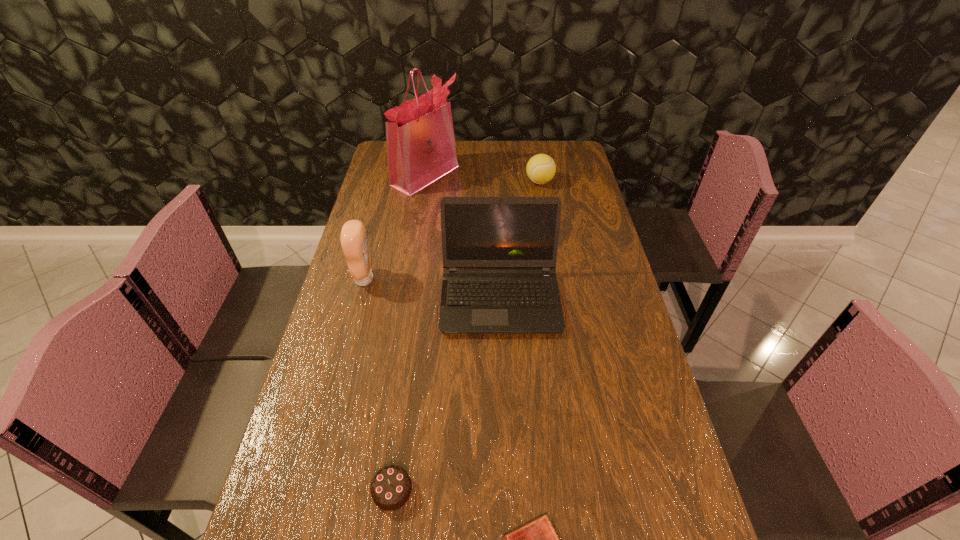
I want to click on vacant point located between the chocolate cake and the laptop_computer, so click(x=446, y=394).

Locate an element on the screen. This screenshot has width=960, height=540. free space that is in between the laptop_computer and the chocolate cake is located at coordinates point(446,394).

Where is `free space between the second nearest object and the tennis ball`? The width and height of the screenshot is (960, 540). free space between the second nearest object and the tennis ball is located at coordinates (466, 336).

You are a GUI agent. You are given a task and a screenshot of the screen. Output one action in this format:
    pyautogui.click(x=<x>, y=<y>)
    Task: Click on the free space between the chocolate cake and the laptop_computer
    
    Given the screenshot: What is the action you would take?
    pyautogui.click(x=446, y=394)

This screenshot has height=540, width=960. What are the coordinates of `free space between the second nearest object and the condiment` in the screenshot? It's located at (378, 384).

Choose which object is the second nearest neighbor to the chocolate cake. Please provide its 2D coordinates. Your answer should be formatted as a tuple, i.e. [(x, y)], where the tuple contains the x and y coordinates of a point satisfying the conditions above.

[(499, 254)]

The height and width of the screenshot is (540, 960). What are the coordinates of `object that stands as the third closest to the fourth shortest object` in the screenshot? It's located at (391, 488).

You are a GUI agent. You are given a task and a screenshot of the screen. Output one action in this format:
    pyautogui.click(x=<x>, y=<y>)
    Task: Click on the vacant space that satisfies the following two spatial constraints: 1. on the label of the second shortest object; 2. on the right side of the condiment
    The image size is (960, 540).
    Given the screenshot: What is the action you would take?
    pyautogui.click(x=309, y=490)

The width and height of the screenshot is (960, 540). In order to click on free location that satisfies the following two spatial constraints: 1. on the front side of the tallest object; 2. on the label of the fourth shortest object in this screenshot , I will do `click(409, 279)`.